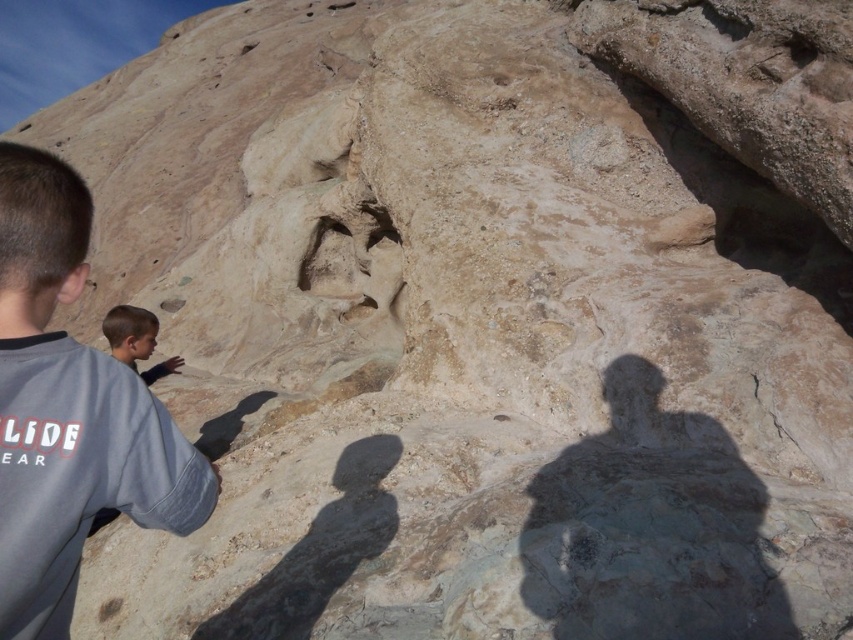
Is gray cotton shirt at upper left shorter than light brown hair at lower left?

In fact, gray cotton shirt at upper left may be taller than light brown hair at lower left.

Who is positioned more to the left, gray cotton shirt at upper left or light brown hair at lower left?

Positioned to the left is light brown hair at lower left.

Is point (76, 180) in front of point (105, 326)?

That is True.

This screenshot has height=640, width=853. Find the location of `gray cotton shirt at upper left`. gray cotton shirt at upper left is located at coordinates (68, 410).

Can you confirm if light brown hair at lower left is thinner than smooth skin face at lower left?

Indeed, light brown hair at lower left has a lesser width compared to smooth skin face at lower left.

Is light brown hair at lower left below smooth skin face at lower left?

Yes.

At what (x,y) coordinates should I click in order to perform the action: click on light brown hair at lower left. Please return your answer as a coordinate pair (x, y). This screenshot has height=640, width=853. Looking at the image, I should click on (131, 333).

Is point (39, 480) positioned before point (149, 348)?

That is True.

Can you confirm if gray cotton shirt at upper left is shorter than smooth skin face at lower left?

In fact, gray cotton shirt at upper left may be taller than smooth skin face at lower left.

Who is more forward, (204, 468) or (155, 324)?

Positioned in front is point (204, 468).

Image resolution: width=853 pixels, height=640 pixels. I want to click on gray cotton shirt at upper left, so click(68, 410).